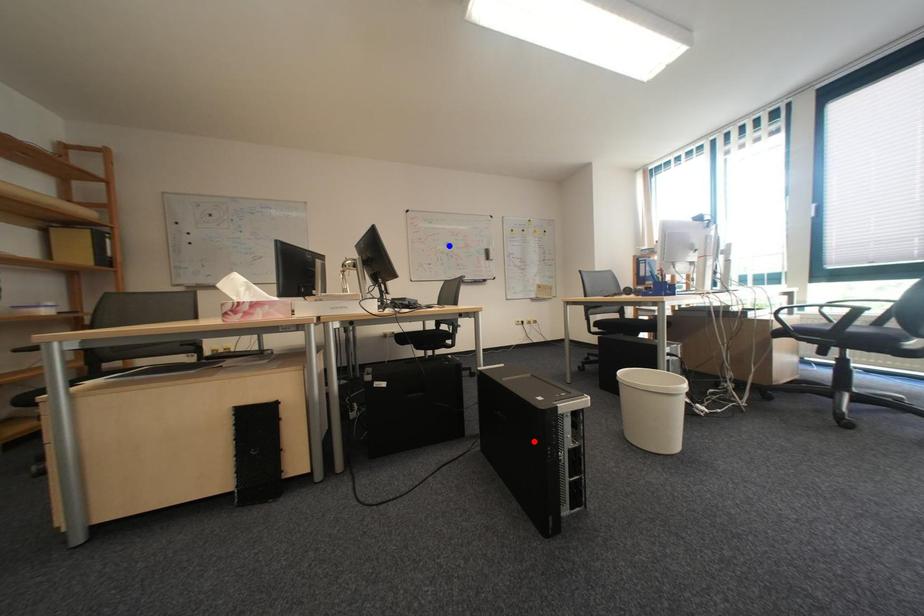
Question: Which of the two points in the image is closer to the camera?

Choices:
 (A) Blue point is closer.
 (B) Red point is closer.

Answer: (B)